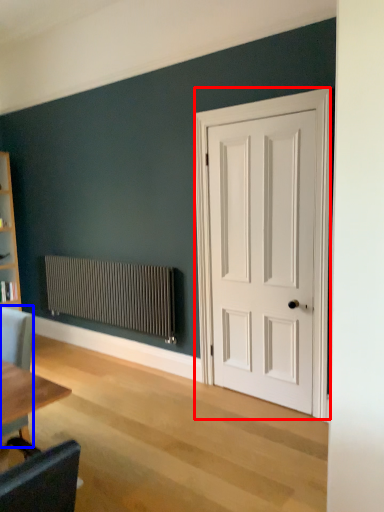
Question: Which of the following is the closest to the observer, door (highlighted by a red box) or chair (highlighted by a blue box)?

Choices:
 (A) door
 (B) chair

Answer: (B)